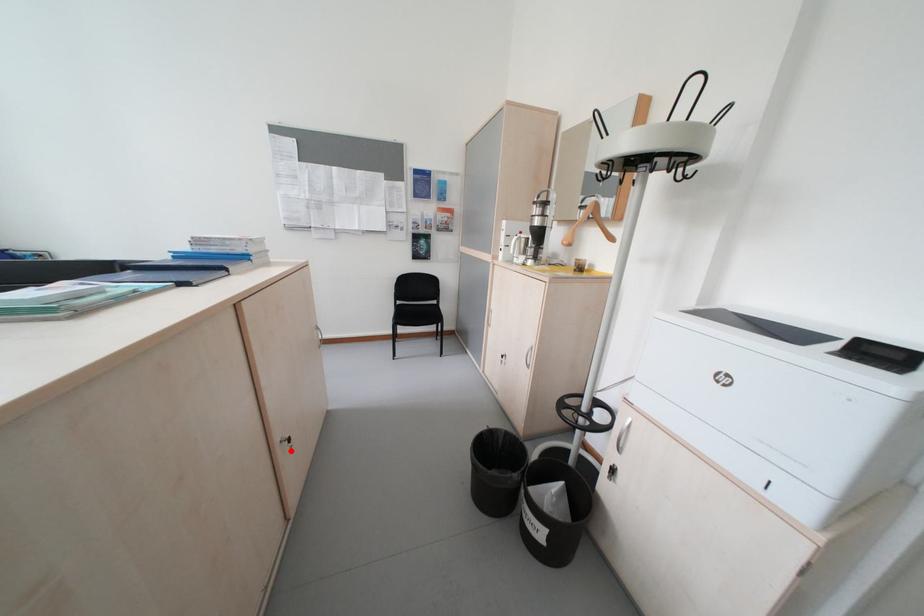
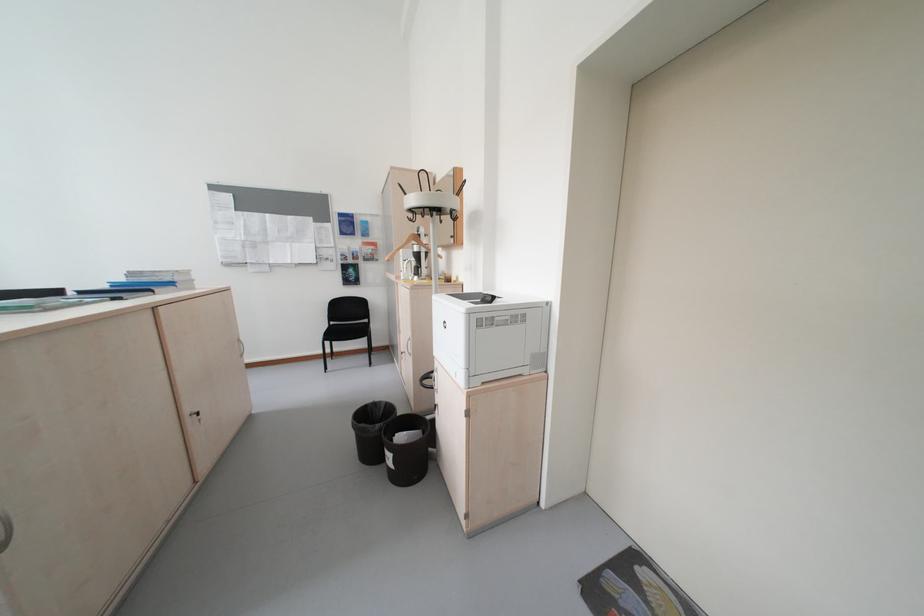
Question: I am providing you with two images of the same scene from different viewpoints. Given a red point in image1, look at the same physical point in image2. Is it:

Choices:
 (A) Closer to the viewpoint
 (B) Farther from the viewpoint

Answer: (B)